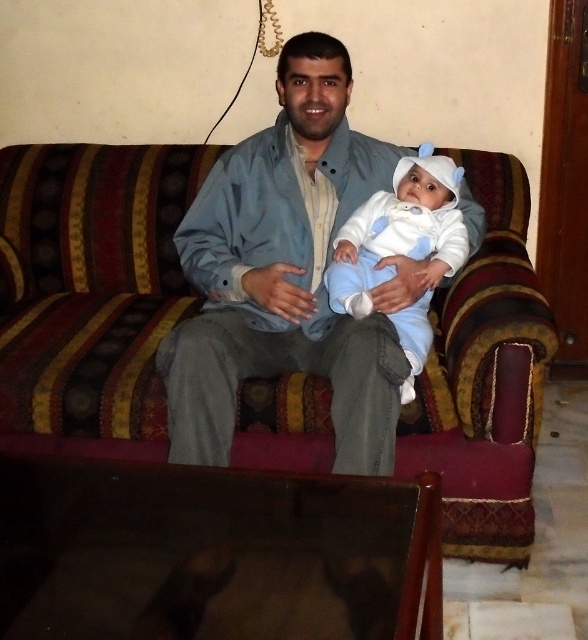
Question: Which object appears closest to the camera in this image?

Choices:
 (A) white soft baby at center
 (B) light blue fabric jacket at center

Answer: (B)

Question: Which of the following is the closest to the observer?

Choices:
 (A) white soft baby at center
 (B) light blue fabric jacket at center

Answer: (B)

Question: Can you confirm if striped fabric couch at center is positioned above white soft baby at center?

Choices:
 (A) no
 (B) yes

Answer: (A)

Question: Does light blue fabric jacket at center have a smaller size compared to white soft baby at center?

Choices:
 (A) yes
 (B) no

Answer: (B)

Question: Considering the real-world distances, which object is farthest from the light blue fabric jacket at center?

Choices:
 (A) white soft baby at center
 (B) striped fabric couch at center

Answer: (B)

Question: Does light blue fabric jacket at center appear under white soft baby at center?

Choices:
 (A) no
 (B) yes

Answer: (A)